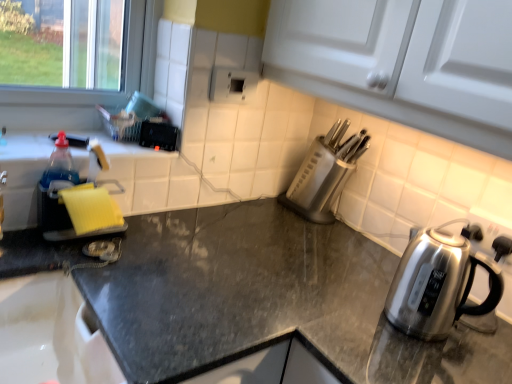
Where is `free space in front of yellow sponge at left`? The height and width of the screenshot is (384, 512). free space in front of yellow sponge at left is located at coordinates [x=71, y=269].